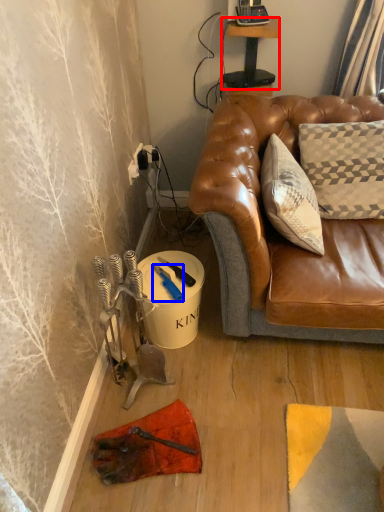
Question: Which of the following is the farthest to the observer, table (highlighted by a red box) or tool (highlighted by a blue box)?

Choices:
 (A) table
 (B) tool

Answer: (A)